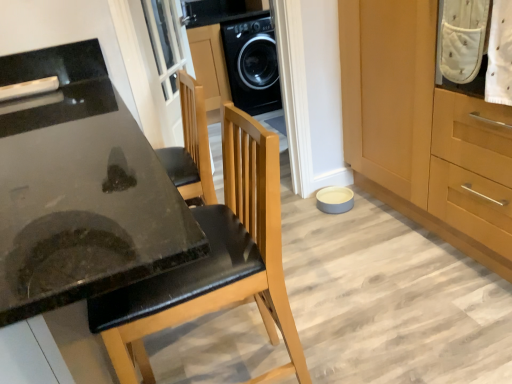
Where is `white dotted fabric at upper right`? white dotted fabric at upper right is located at coordinates (467, 43).

In order to face white glass screen door at upper center, should I rotate leftwards or rightwards?

Turn left approximately 10.844 degrees to face it.

You are a GUI agent. You are given a task and a screenshot of the screen. Output one action in this format:
    pyautogui.click(x=<x>, y=<y>)
    Task: Click on the black glossy countertop at lower left
    
    Given the screenshot: What is the action you would take?
    pyautogui.click(x=80, y=189)

Measure the distance between black glossy washing machine at center and camera.

black glossy washing machine at center and camera are 3.69 meters apart from each other.

Find the location of a particular element. Image resolution: width=512 pixels, height=384 pixels. wooden cabinet at lower right is located at coordinates (422, 130).

Would you say black leather chair at center is a long distance from white glass screen door at upper center?

Absolutely, black leather chair at center is distant from white glass screen door at upper center.

Which object is closer to the camera taking this photo, black leather chair at center or white glass screen door at upper center?

black leather chair at center is closer to the camera.

Consider the image. From the image's perspective, is black leather chair at center above white glass screen door at upper center?

Actually, black leather chair at center appears below white glass screen door at upper center in the image.

What's the angular difference between black leather chair at center and white glass screen door at upper center's facing directions?

black leather chair at center and white glass screen door at upper center are facing 149 degrees away from each other.

From the image's perspective, is wooden cabinet at lower right located beneath black glossy washing machine at center?

Indeed, from the image's perspective, wooden cabinet at lower right is shown beneath black glossy washing machine at center.

Considering the sizes of objects wooden cabinet at lower right and black glossy washing machine at center in the image provided, who is thinner, wooden cabinet at lower right or black glossy washing machine at center?

With smaller width is black glossy washing machine at center.

Which point is more forward, (495, 267) or (231, 74)?

Point (495, 267)

Considering the sizes of wooden cabinet at lower right and black glossy washing machine at center in the image, is wooden cabinet at lower right taller or shorter than black glossy washing machine at center?

wooden cabinet at lower right is taller than black glossy washing machine at center.

Could you tell me if black glossy washing machine at center is facing white glass screen door at upper center?

No, black glossy washing machine at center is not facing towards white glass screen door at upper center.

Which of these two, black glossy washing machine at center or white glass screen door at upper center, is wider?

With larger width is black glossy washing machine at center.

From a real-world perspective, is black glossy washing machine at center over white glass screen door at upper center?

No.

You are a GUI agent. You are given a task and a screenshot of the screen. Output one action in this format:
    pyautogui.click(x=<x>, y=<y>)
    Task: Click on the home appliance behind the white glass screen door at upper center
    The height and width of the screenshot is (384, 512).
    Given the screenshot: What is the action you would take?
    pyautogui.click(x=252, y=63)

Is the surface of white dotted fabric at upper right in direct contact with black leather chair at center?

white dotted fabric at upper right is not next to black leather chair at center, and they're not touching.

Which of these two, white dotted fabric at upper right or black leather chair at center, stands shorter?

white dotted fabric at upper right.

Can you confirm if white dotted fabric at upper right is positioned to the right of black leather chair at center?

Yes.

From the image's perspective, relative to black leather chair at center, is white dotted fabric at upper right above or below?

Clearly, from the image's perspective, white dotted fabric at upper right is above black leather chair at center.

Is white dotted fabric at upper right positioned behind black glossy countertop at lower left?

That is True.

Locate an element on the screen. This screenshot has width=512, height=384. laundry that is above the black glossy countertop at lower left (from the image's perspective) is located at coordinates (467, 43).

What's the angular difference between white dotted fabric at upper right and black glossy countertop at lower left's facing directions?

The facing directions of white dotted fabric at upper right and black glossy countertop at lower left are 0.891 degrees apart.

Is white dotted fabric at upper right to the left of black glossy countertop at lower left from the viewer's perspective?

Incorrect, white dotted fabric at upper right is not on the left side of black glossy countertop at lower left.

Is white glass screen door at upper center facing away from black leather chair at center?

white glass screen door at upper center is not turned away from black leather chair at center.

Is white glass screen door at upper center far away from black leather chair at center?

Absolutely, white glass screen door at upper center is distant from black leather chair at center.

Is white glass screen door at upper center positioned beyond the bounds of black leather chair at center?

white glass screen door at upper center is positioned outside black leather chair at center.

Consider the image. Is black glossy washing machine at center outside of black glossy countertop at lower left?

Yes.

Considering the positions of point (266, 111) and point (69, 186), is point (266, 111) closer or farther from the camera than point (69, 186)?

Point (266, 111) is positioned farther from the camera compared to point (69, 186).

Considering the relative sizes of black glossy washing machine at center and black glossy countertop at lower left in the image provided, is black glossy washing machine at center shorter than black glossy countertop at lower left?

Correct, black glossy washing machine at center is not as tall as black glossy countertop at lower left.

From the picture: Between black glossy washing machine at center and black glossy countertop at lower left, which one has smaller width?

Thinner between the two is black glossy washing machine at center.

The width and height of the screenshot is (512, 384). Identify the location of screen door lying behind the black leather chair at center. (163, 61).

At what (x,y) coordinates should I click in order to perform the action: click on cabinetry that is on the right side of black glossy washing machine at center. Please return your answer as a coordinate pair (x, y). The height and width of the screenshot is (384, 512). Looking at the image, I should click on (422, 130).

Considering their positions, is wooden cabinet at lower right positioned further to white glass screen door at upper center than black leather chair at center?

black leather chair at center lies further to white glass screen door at upper center than the other object.

In the scene shown: Based on their spatial positions, is black leather chair at center or wooden cabinet at lower right further from black glossy countertop at lower left?

The object further to black glossy countertop at lower left is wooden cabinet at lower right.

Estimate the real-world distances between objects in this image. Which object is closer to white dotted fabric at upper right, black leather chair at center or white glass screen door at upper center?

black leather chair at center is closer to white dotted fabric at upper right.

When comparing their distances from black leather chair at center, does black glossy countertop at lower left or black glossy washing machine at center seem further?

Based on the image, black glossy washing machine at center appears to be further to black leather chair at center.

Which object lies nearer to the anchor point black glossy countertop at lower left, wooden cabinet at lower right or black leather chair at center?

black leather chair at center.

Looking at the image, which one is located further to black glossy countertop at lower left, white glass screen door at upper center or wooden cabinet at lower right?

wooden cabinet at lower right lies further to black glossy countertop at lower left than the other object.

When comparing their distances from black leather chair at center, does white dotted fabric at upper right or wooden cabinet at lower right seem closer?

white dotted fabric at upper right is positioned closer to the anchor black leather chair at center.

Based on their spatial positions, is white glass screen door at upper center or black leather chair at center closer to black glossy countertop at lower left?

black leather chair at center lies closer to black glossy countertop at lower left than the other object.

I want to click on screen door between black leather chair at center and black glossy washing machine at center in the front-back direction, so click(x=163, y=61).

Find the location of a particular element. The width and height of the screenshot is (512, 384). chair between black glossy countertop at lower left and wooden cabinet at lower right from left to right is located at coordinates (215, 263).

At what (x,y) coordinates should I click in order to perform the action: click on screen door between wooden cabinet at lower right and black glossy washing machine at center in the front-back direction. Please return your answer as a coordinate pair (x, y). Looking at the image, I should click on (163, 61).

The width and height of the screenshot is (512, 384). Find the location of `laundry situated between black leather chair at center and wooden cabinet at lower right from left to right`. laundry situated between black leather chair at center and wooden cabinet at lower right from left to right is located at coordinates (467, 43).